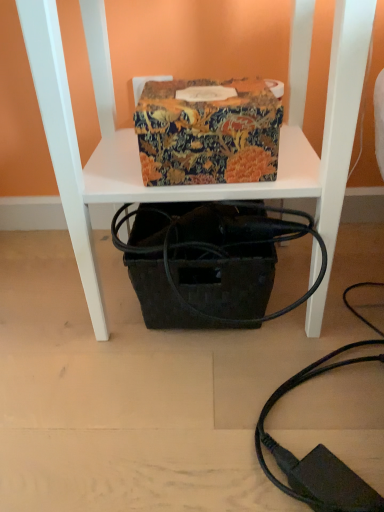
This screenshot has height=512, width=384. I want to click on black woven basket at lower center, so click(x=187, y=187).

This screenshot has height=512, width=384. Identify the location of black woven basket at center. coord(195,186).

Find the location of a particular element. black woven basket at lower center is located at coordinates (187, 187).

Is the position of patterned fabric box at center more distant than that of black woven basket at lower center?

Yes, it is.

Does point (236, 82) come behind point (136, 197)?

Yes, point (236, 82) is behind point (136, 197).

Can you confirm if patterned fabric box at center is bigger than black woven basket at lower center?

Actually, patterned fabric box at center might be smaller than black woven basket at lower center.

Is patterned fabric box at center wider or thinner than black woven basket at lower center?

Clearly, patterned fabric box at center has less width compared to black woven basket at lower center.

Which of these two, black woven basket at center or patterned fabric box at center, is bigger?

black woven basket at center is bigger.

Are black woven basket at center and patterned fabric box at center making contact?

Yes, black woven basket at center is beside patterned fabric box at center.

From the picture: From a real-world perspective, is black woven basket at center physically located above or below patterned fabric box at center?

From a real-world perspective, black woven basket at center is physically below patterned fabric box at center.

From the image's perspective, relative to patterned fabric box at center, is black woven basket at center above or below?

Based on their image positions, black woven basket at center is located beneath patterned fabric box at center.

Is black woven basket at lower center at the back of black woven basket at center?

Absolutely, black woven basket at center is directed away from black woven basket at lower center.

Where is `table lying below the black woven basket at lower center (from the image's perspective)`? The width and height of the screenshot is (384, 512). table lying below the black woven basket at lower center (from the image's perspective) is located at coordinates (195, 186).

Is black woven basket at center smaller than black woven basket at lower center?

Correct, black woven basket at center occupies less space than black woven basket at lower center.

Does black woven basket at center have a greater width compared to black woven basket at lower center?

No.

Is black woven basket at lower center facing towards black woven basket at center?

Yes, black woven basket at lower center is turned towards black woven basket at center.

Does black woven basket at lower center have a larger size compared to black woven basket at center?

Correct, black woven basket at lower center is larger in size than black woven basket at center.

Would you say black woven basket at lower center is outside black woven basket at center?

That's correct, black woven basket at lower center is outside of black woven basket at center.

Does black woven basket at lower center have a lesser height compared to black woven basket at center?

No.

From a real-world perspective, relative to patterned fabric box at center, is black woven basket at lower center vertically above or below?

Clearly, from a real-world perspective, black woven basket at lower center is below patterned fabric box at center.

From the image's perspective, is black woven basket at lower center under patterned fabric box at center?

Correct, black woven basket at lower center appears lower than patterned fabric box at center in the image.

How many degrees apart are the facing directions of black woven basket at lower center and patterned fabric box at center?

There is a 1.67-degree angle between the facing directions of black woven basket at lower center and patterned fabric box at center.

Where is `cardboard box that is behind the black woven basket at lower center`? cardboard box that is behind the black woven basket at lower center is located at coordinates (208, 131).

Identify the location of table that appears below the patterned fabric box at center (from the image's perspective). (195, 186).

From a real-world perspective, is patterned fabric box at center physically above black woven basket at center?

Yes, from a real-world perspective, patterned fabric box at center is over black woven basket at center

How many degrees apart are the facing directions of patterned fabric box at center and black woven basket at center?

0.601 degrees separate the facing orientations of patterned fabric box at center and black woven basket at center.

Who is bigger, patterned fabric box at center or black woven basket at center?

black woven basket at center.

Find the location of `cardboard box lying above the black woven basket at lower center (from the image's perspective)`. cardboard box lying above the black woven basket at lower center (from the image's perspective) is located at coordinates (208, 131).

The height and width of the screenshot is (512, 384). Identify the location of table behind the patterned fabric box at center. (195, 186).

Estimate the real-world distances between objects in this image. Which object is further from black woven basket at lower center, patterned fabric box at center or black woven basket at center?

patterned fabric box at center lies further to black woven basket at lower center than the other object.

When comparing their distances from black woven basket at center, does patterned fabric box at center or black woven basket at lower center seem closer?

Based on the image, black woven basket at lower center appears to be nearer to black woven basket at center.

Considering their positions, is black woven basket at center positioned closer to patterned fabric box at center than black woven basket at lower center?

black woven basket at center is positioned closer to the anchor patterned fabric box at center.

When comparing their distances from black woven basket at center, does black woven basket at lower center or patterned fabric box at center seem further?

patterned fabric box at center lies further to black woven basket at center than the other object.

When comparing their distances from black woven basket at lower center, does black woven basket at center or patterned fabric box at center seem further?

patterned fabric box at center lies further to black woven basket at lower center than the other object.

Considering their positions, is black woven basket at lower center positioned further to patterned fabric box at center than black woven basket at center?

The object further to patterned fabric box at center is black woven basket at lower center.

Where is `furniture between patterned fabric box at center and black woven basket at center vertically`? This screenshot has height=512, width=384. furniture between patterned fabric box at center and black woven basket at center vertically is located at coordinates (187, 187).